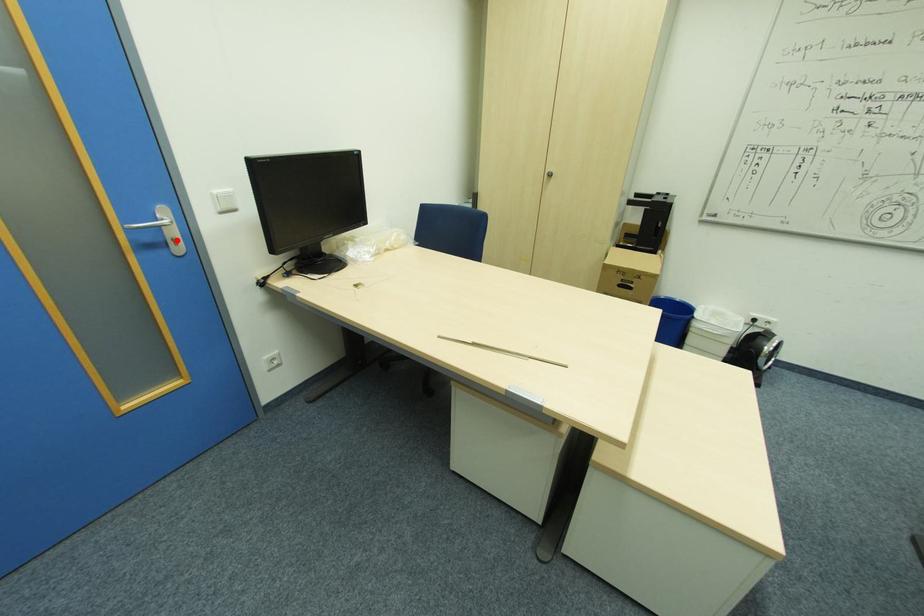
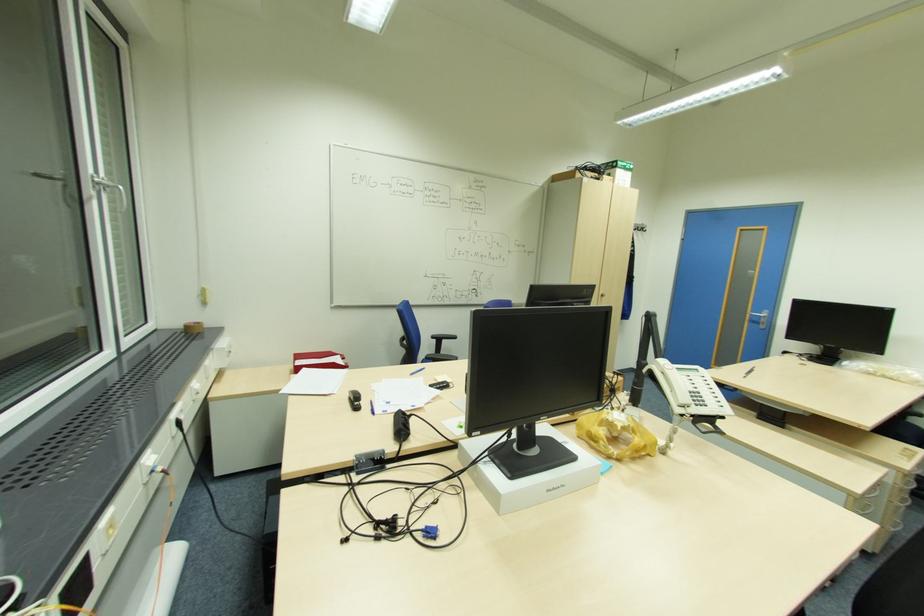
Where in the second image is the point corresponding to the highlighted location from the first image?

(766, 323)